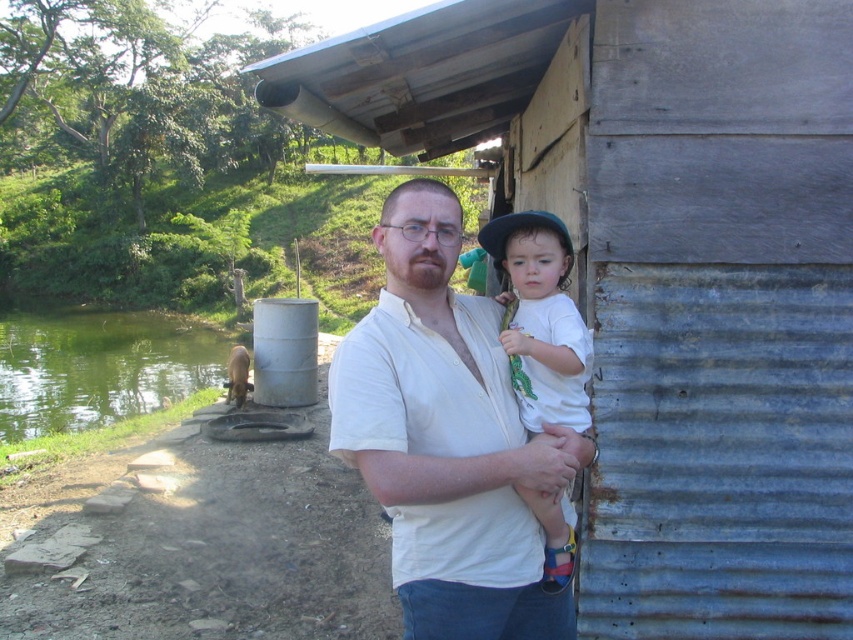
Question: Can you confirm if rusty corrugated metal hut at center-right is positioned to the left of white matte shirt at center?

Choices:
 (A) no
 (B) yes

Answer: (A)

Question: Which point is farther from the camera taking this photo?

Choices:
 (A) (567, 417)
 (B) (784, 285)
 (C) (376, 312)

Answer: (B)

Question: Observing the image, what is the correct spatial positioning of white cotton shirt at center in reference to white matte shirt at center?

Choices:
 (A) below
 (B) above

Answer: (A)

Question: Which object appears farthest from the camera in this image?

Choices:
 (A) white cotton shirt at center
 (B) rusty corrugated metal hut at center-right
 (C) white matte shirt at center

Answer: (B)

Question: Can you confirm if rusty corrugated metal hut at center-right is thinner than white matte shirt at center?

Choices:
 (A) yes
 (B) no

Answer: (B)

Question: Which of these objects is positioned closest to the white cotton shirt at center?

Choices:
 (A) white matte shirt at center
 (B) rusty corrugated metal hut at center-right

Answer: (A)